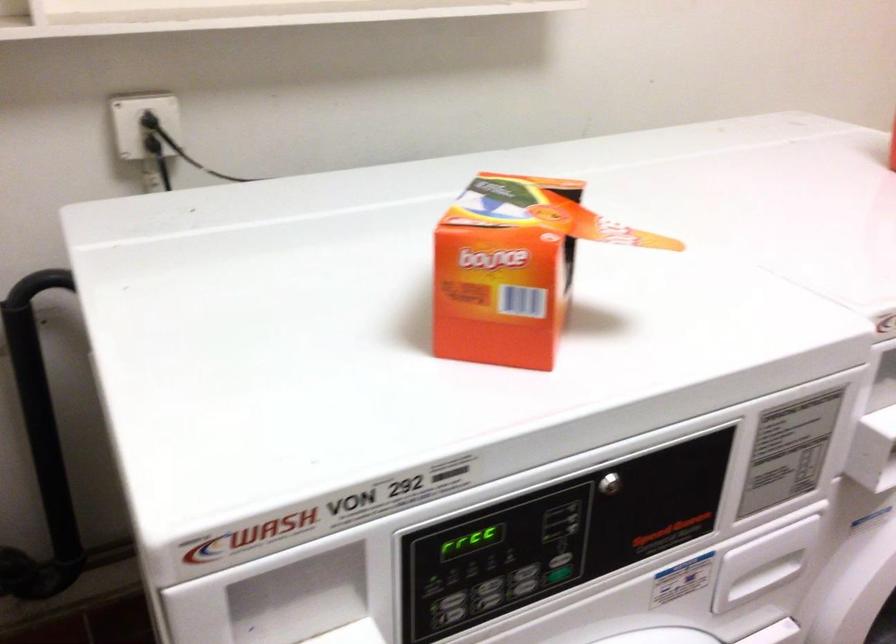
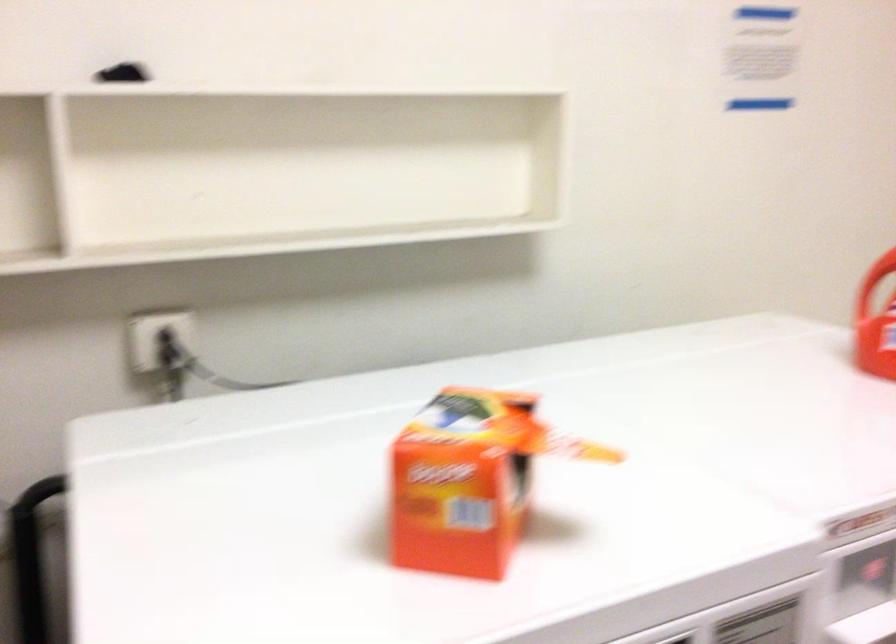
The images are taken continuously from a first-person perspective. In which direction are you moving?

The cameraman moved toward right, backward.